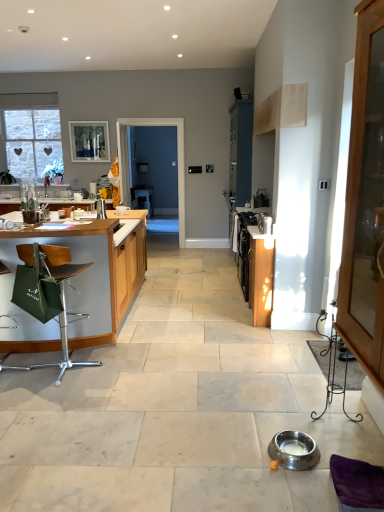
Identify the location of free space in front of stainless steel bowl at lower center, acting as the 2th appliance starting from the top. (293, 485).